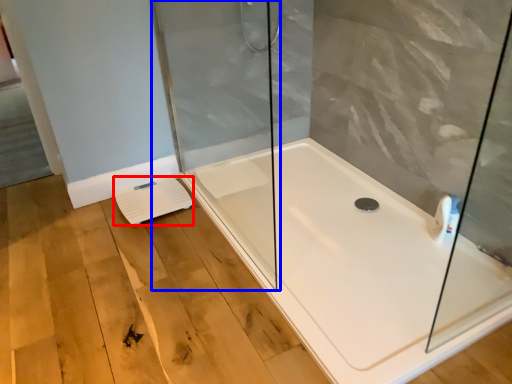
Question: Which point is further to the camera, lift (highlighted by a red box) or shower door (highlighted by a blue box)?

Choices:
 (A) lift
 (B) shower door

Answer: (A)